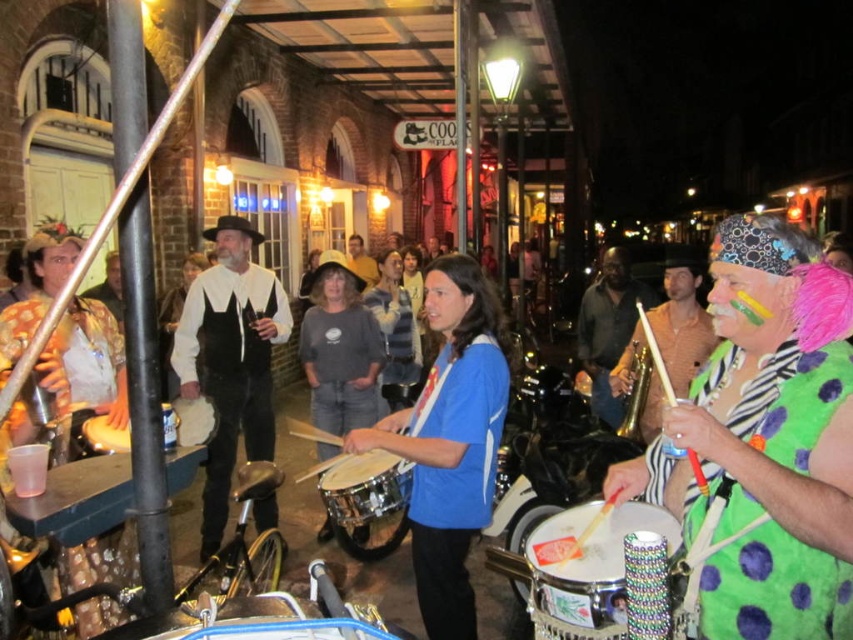
Question: Which object is farther from the camera taking this photo?

Choices:
 (A) gray cotton shirt at center
 (B) blue fabric shirt at center
 (C) green polka dot shirt at center
 (D) matte gold trumpet at center

Answer: (A)

Question: In this image, where is white matte vest at center located relative to matte gold trumpet at center?

Choices:
 (A) below
 (B) above

Answer: (A)

Question: Can you confirm if matte gold trumpet at center is positioned to the right of gray cotton shirt at center?

Choices:
 (A) yes
 (B) no

Answer: (A)

Question: Which object is farther from the camera taking this photo?

Choices:
 (A) shiny silver drum at center
 (B) blue fabric shirt at center
 (C) matte brown saxophone at center
 (D) shiny metallic drum at center

Answer: (C)

Question: Is blue fabric shirt at center smaller than white matte vest at center?

Choices:
 (A) yes
 (B) no

Answer: (A)

Question: Which point is farther to the camera?

Choices:
 (A) matte white drum at lower left
 (B) shiny metallic drum at center
 (C) gold metallic saxophone at center-right

Answer: (C)